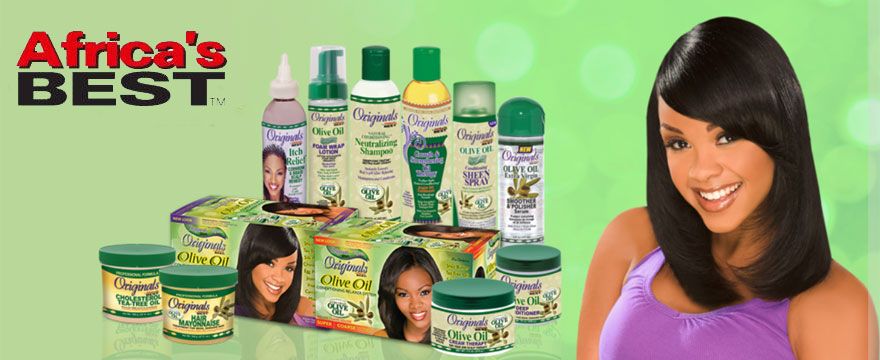
The width and height of the screenshot is (880, 360). In order to click on bottles in this screenshot , I will do `click(272, 121)`, `click(321, 119)`, `click(377, 110)`, `click(426, 111)`, `click(479, 151)`, `click(519, 143)`.